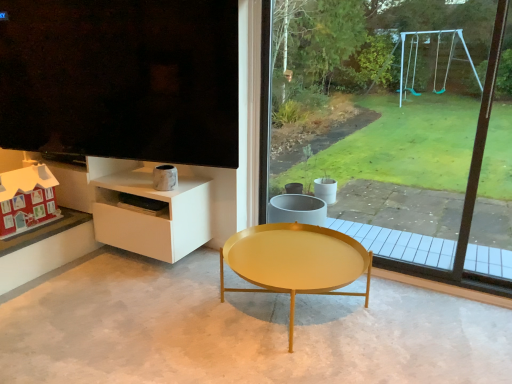
Question: Are gold metallic coffee table at center and transparent glass window at center far apart?

Choices:
 (A) yes
 (B) no

Answer: (A)

Question: From the image's perspective, is gold metallic coffee table at center below transparent glass window at center?

Choices:
 (A) yes
 (B) no

Answer: (A)

Question: Is gold metallic coffee table at center next to transparent glass window at center and touching it?

Choices:
 (A) no
 (B) yes

Answer: (A)

Question: Can you confirm if gold metallic coffee table at center is smaller than transparent glass window at center?

Choices:
 (A) no
 (B) yes

Answer: (A)

Question: Can you confirm if gold metallic coffee table at center is positioned to the left of transparent glass window at center?

Choices:
 (A) yes
 (B) no

Answer: (A)

Question: Based on their sizes in the image, would you say white glossy shelf at lower left is bigger or smaller than matte red wooden house at lower left?

Choices:
 (A) big
 (B) small

Answer: (A)

Question: Considering the positions of white glossy shelf at lower left and matte red wooden house at lower left in the image, is white glossy shelf at lower left taller or shorter than matte red wooden house at lower left?

Choices:
 (A) short
 (B) tall

Answer: (B)

Question: Looking at their shapes, would you say white glossy shelf at lower left is wider or thinner than matte red wooden house at lower left?

Choices:
 (A) wide
 (B) thin

Answer: (A)

Question: Based on their positions, is white glossy shelf at lower left located to the left or right of matte red wooden house at lower left?

Choices:
 (A) left
 (B) right

Answer: (B)

Question: In terms of width, does matte red wooden house at lower left look wider or thinner when compared to gold metallic coffee table at center?

Choices:
 (A) thin
 (B) wide

Answer: (A)

Question: Relative to gold metallic coffee table at center, is matte red wooden house at lower left in front or behind?

Choices:
 (A) front
 (B) behind

Answer: (B)

Question: Is point (4, 198) closer or farther from the camera than point (346, 266)?

Choices:
 (A) closer
 (B) farther

Answer: (B)

Question: Is matte red wooden house at lower left to the left or to the right of gold metallic coffee table at center in the image?

Choices:
 (A) left
 (B) right

Answer: (A)

Question: Is matte black screen at upper left wider or thinner than gold metallic coffee table at center?

Choices:
 (A) thin
 (B) wide

Answer: (A)

Question: From a real-world perspective, is matte black screen at upper left physically located above or below gold metallic coffee table at center?

Choices:
 (A) above
 (B) below

Answer: (A)